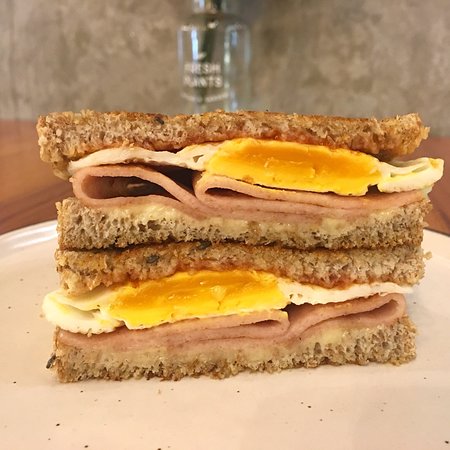
Image resolution: width=450 pixels, height=450 pixels. What are the coordinates of `wooden table` in the screenshot? It's located at (42, 192).